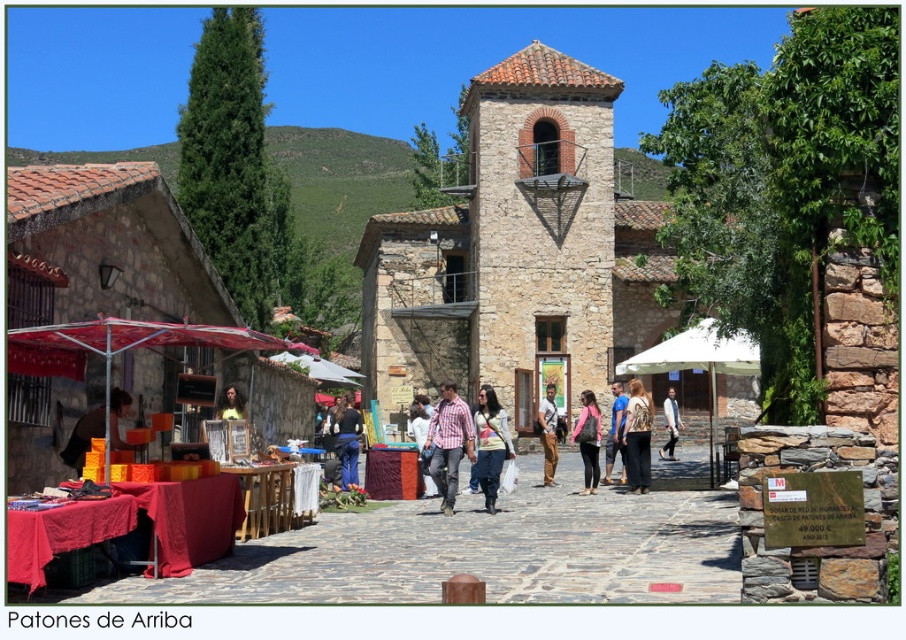
Consider the image. Who is shorter, patterned fabric dress at center or blue denim jeans at center?

With less height is blue denim jeans at center.

Locate an element on the screen. The height and width of the screenshot is (640, 906). patterned fabric dress at center is located at coordinates (637, 436).

This screenshot has height=640, width=906. What are the coordinates of `patterned fabric dress at center` in the screenshot? It's located at (637, 436).

Find the location of `patterned fabric dress at center`. patterned fabric dress at center is located at coordinates (637, 436).

Can you confirm if patterned fabric dress at center is bigger than denim pants at center?

No.

You are a GUI agent. You are given a task and a screenshot of the screen. Output one action in this format:
    pyautogui.click(x=<x>, y=<y>)
    Task: Click on the patterned fabric dress at center
    The height and width of the screenshot is (640, 906).
    Given the screenshot: What is the action you would take?
    pyautogui.click(x=637, y=436)

Between matte red fabric stall at left and patterned fabric dress at center, which one has more height?

Standing taller between the two is matte red fabric stall at left.

Who is lower down, matte red fabric stall at left or patterned fabric dress at center?

patterned fabric dress at center

What do you see at coordinates (122, 348) in the screenshot? I see `matte red fabric stall at left` at bounding box center [122, 348].

This screenshot has width=906, height=640. I want to click on matte red fabric stall at left, so click(122, 348).